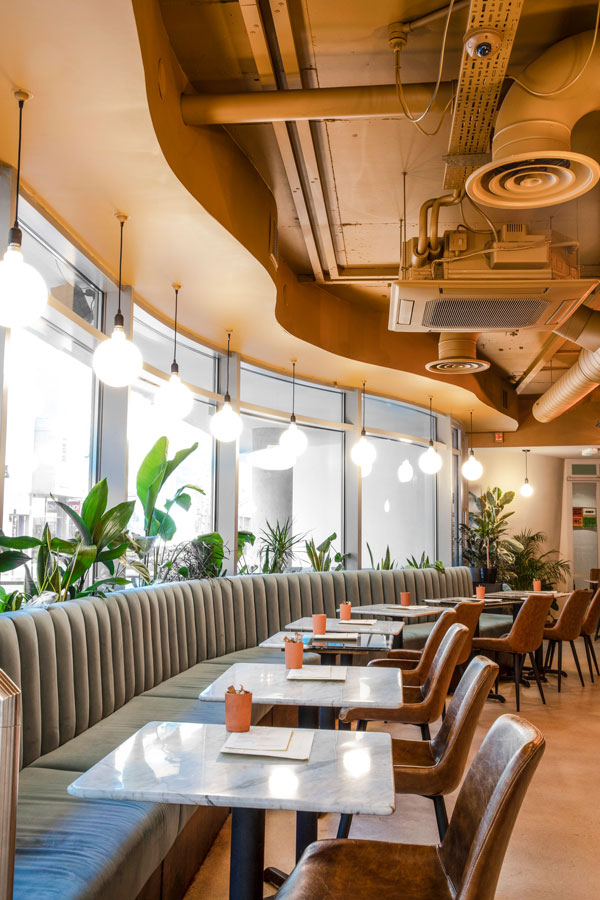
In order to click on single brown chairs in this screenshot , I will do `click(494, 801)`, `click(451, 732)`, `click(448, 658)`, `click(438, 627)`, `click(473, 605)`, `click(528, 614)`, `click(577, 610)`, `click(592, 616)`.